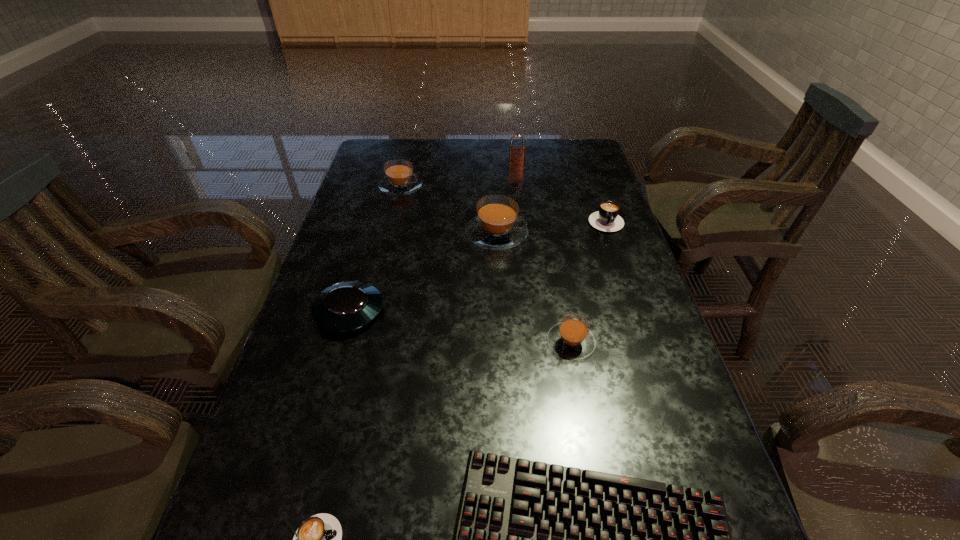
Identify the location of padlock. This screenshot has height=540, width=960. [516, 152].

The height and width of the screenshot is (540, 960). Identify the location of brown padlock. (516, 152).

Find the location of a particular element. The width and height of the screenshot is (960, 540). the third cappuccino from left to right is located at coordinates (497, 227).

Locate an element on the screen. The height and width of the screenshot is (540, 960). the second nearest brown cappuccino is located at coordinates (497, 227).

This screenshot has height=540, width=960. What are the coordinates of `the second biggest brown cappuccino` in the screenshot? It's located at (400, 179).

Where is `the leftmost brown cappuccino`? Image resolution: width=960 pixels, height=540 pixels. the leftmost brown cappuccino is located at coordinates (400, 179).

Locate an element on the screen. The image size is (960, 540). the right black cappuccino is located at coordinates (607, 219).

The width and height of the screenshot is (960, 540). Find the location of `the farther black cappuccino`. the farther black cappuccino is located at coordinates (607, 219).

In order to click on the smallest brown cappuccino in this screenshot , I will do `click(571, 338)`.

Where is `the rightmost brown cappuccino`? The width and height of the screenshot is (960, 540). the rightmost brown cappuccino is located at coordinates (571, 338).